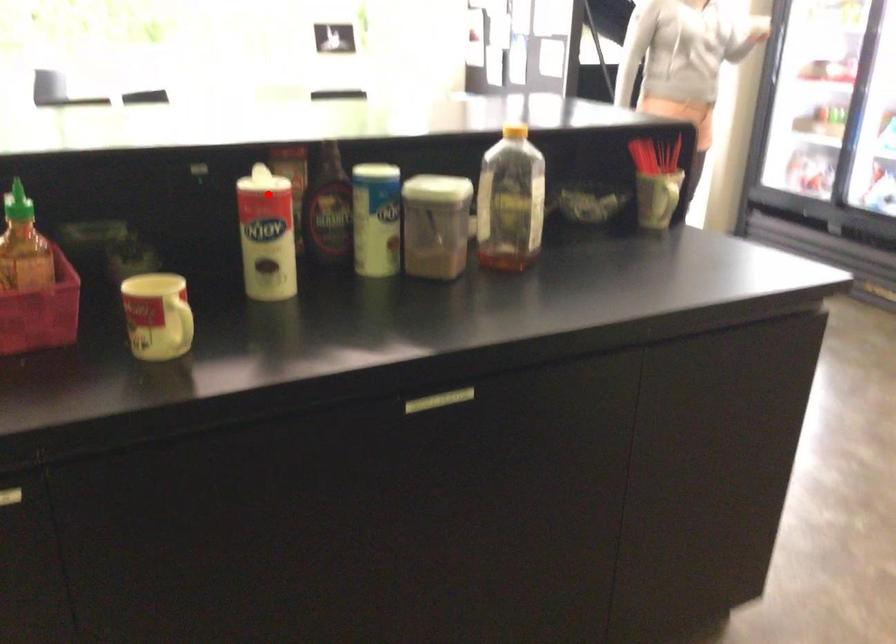
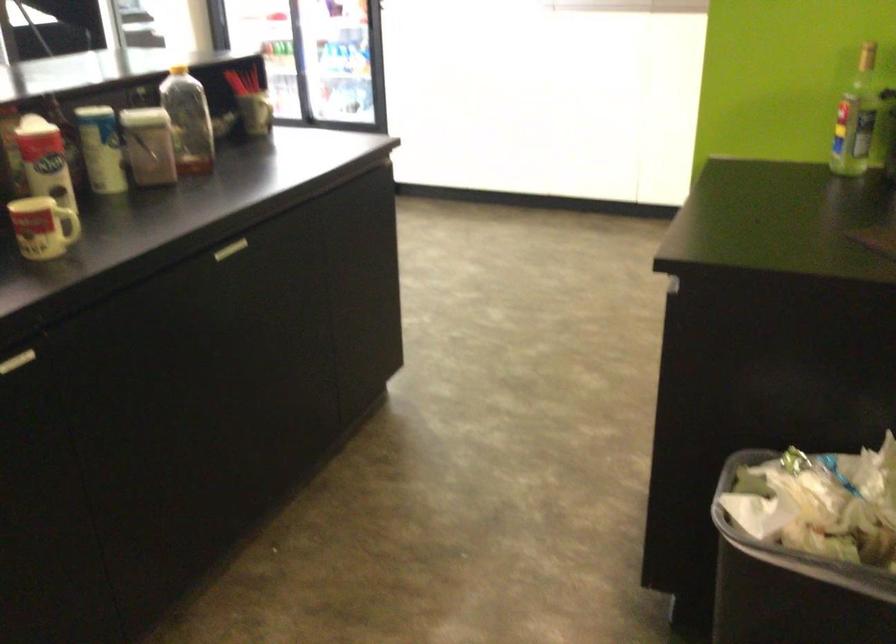
Question: I am providing you with two images of the same scene from different viewpoints. Image1 has a red point marked. In image2, the corresponding 3D location appears at what relative position? Reply with the corresponding letter.

Choices:
 (A) Closer
 (B) Farther

Answer: (B)